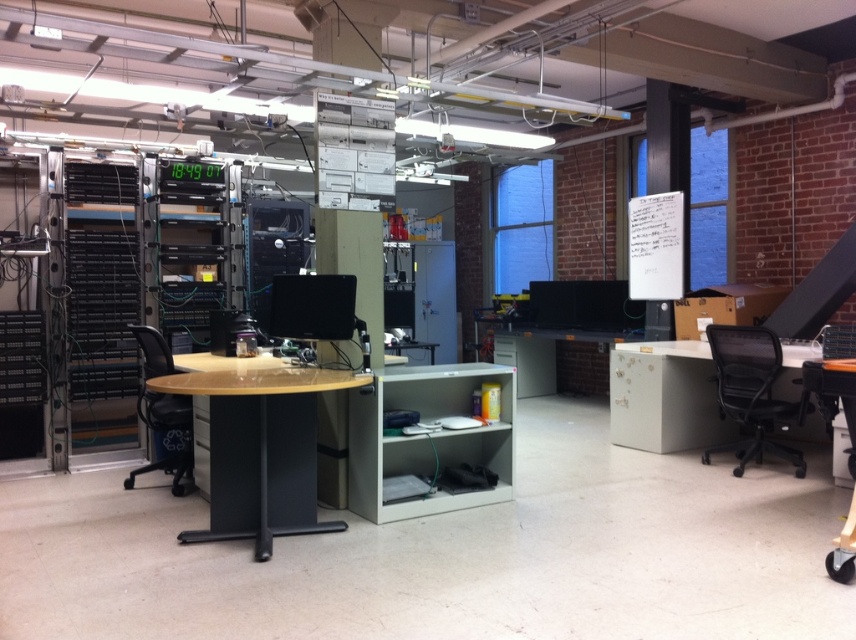
You are an office worker who needs to move a box from the white matte table at right to the black mesh office chair at right. Which direction should you move the box to place it on the chair?

The white matte table at right is positioned on the left side of the black mesh office chair at right, so you should move the box to the right to place it on the black mesh office chair at right.

What object is located at the coordinates point (x=260, y=449) in the image?

The point (x=260, y=449) marks the location of the light brown glossy table at center.